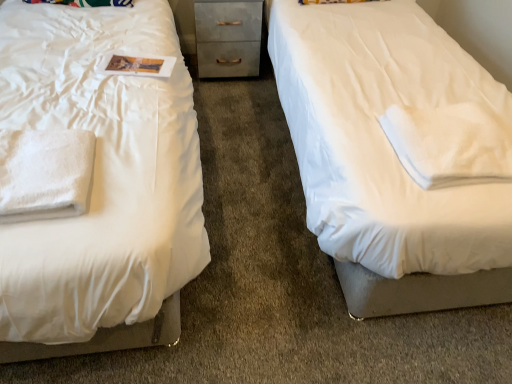
Question: Considering the relative sizes of white soft cloth at right, arranged as the first cloth when viewed from the right, and white soft towel at left, marked as the 1th cloth in a left-to-right arrangement, in the image provided, is white soft cloth at right, arranged as the first cloth when viewed from the right, shorter than white soft towel at left, marked as the 1th cloth in a left-to-right arrangement,?

Choices:
 (A) yes
 (B) no

Answer: (A)

Question: From a real-world perspective, is white soft cloth at right, which is the second cloth in left-to-right order, beneath white soft towel at left, marked as the 1th cloth in a left-to-right arrangement?

Choices:
 (A) yes
 (B) no

Answer: (A)

Question: Can you confirm if white soft cloth at right, which is the second cloth in left-to-right order, is wider than white soft towel at left, marked as the 1th cloth in a left-to-right arrangement?

Choices:
 (A) yes
 (B) no

Answer: (A)

Question: From a real-world perspective, is white soft cloth at right, arranged as the first cloth when viewed from the right, over white soft towel at left, marked as the 1th cloth in a left-to-right arrangement?

Choices:
 (A) yes
 (B) no

Answer: (B)

Question: Is white soft cloth at right, arranged as the first cloth when viewed from the right, not within white soft towel at left, marked as the 1th cloth in a left-to-right arrangement?

Choices:
 (A) yes
 (B) no

Answer: (A)

Question: Is point (33, 152) closer or farther from the camera than point (249, 44)?

Choices:
 (A) farther
 (B) closer

Answer: (B)

Question: In the image, is white soft towel at left, marked as the 1th cloth in a left-to-right arrangement, on the left side or the right side of metallic gray chest of drawers at center?

Choices:
 (A) right
 (B) left

Answer: (B)

Question: In terms of size, does white soft towel at left, marked as the 1th cloth in a left-to-right arrangement, appear bigger or smaller than metallic gray chest of drawers at center?

Choices:
 (A) small
 (B) big

Answer: (A)

Question: In terms of width, does white soft towel at left, placed as the second cloth when sorted from right to left, look wider or thinner when compared to metallic gray chest of drawers at center?

Choices:
 (A) thin
 (B) wide

Answer: (A)

Question: Would you say white soft cloth at right, arranged as the first cloth when viewed from the right, is inside or outside white soft towel at left, placed as the second cloth when sorted from right to left?

Choices:
 (A) outside
 (B) inside

Answer: (A)

Question: Considering the positions of white soft cloth at right, arranged as the first cloth when viewed from the right, and white soft towel at left, marked as the 1th cloth in a left-to-right arrangement, in the image, is white soft cloth at right, arranged as the first cloth when viewed from the right, wider or thinner than white soft towel at left, marked as the 1th cloth in a left-to-right arrangement,?

Choices:
 (A) wide
 (B) thin

Answer: (A)

Question: Is white soft cloth at right, which is the second cloth in left-to-right order, taller or shorter than white soft towel at left, marked as the 1th cloth in a left-to-right arrangement?

Choices:
 (A) tall
 (B) short

Answer: (B)

Question: From the image's perspective, is white soft cloth at right, which is the second cloth in left-to-right order, positioned above or below white soft towel at left, marked as the 1th cloth in a left-to-right arrangement?

Choices:
 (A) below
 (B) above

Answer: (B)

Question: From the image's perspective, is white soft cloth at right, which is the second cloth in left-to-right order, positioned above or below metallic gray chest of drawers at center?

Choices:
 (A) below
 (B) above

Answer: (A)

Question: Is white soft cloth at right, arranged as the first cloth when viewed from the right, inside the boundaries of metallic gray chest of drawers at center, or outside?

Choices:
 (A) outside
 (B) inside

Answer: (A)